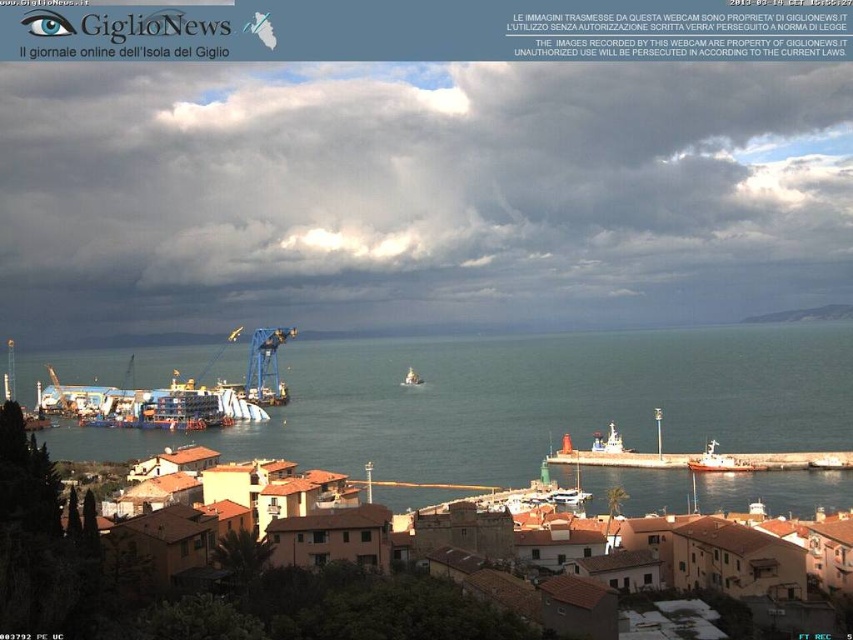
Question: Which of these objects is positioned closest to the metallic silver boat at center?

Choices:
 (A) brown matte building at lower center
 (B) metallic silver boat at lower right
 (C) blue water at center
 (D) white plastic boat at center

Answer: (C)

Question: Which point is closer to the camera?

Choices:
 (A) brown matte building at lower center
 (B) blue water at center
 (C) white plastic boat at center

Answer: (A)

Question: In this image, where is blue water at center located relative to white plastic boat at center?

Choices:
 (A) above
 (B) below

Answer: (A)

Question: Estimate the real-world distances between objects in this image. Which object is farther from the white plastic boat at center?

Choices:
 (A) metallic silver boat at lower right
 (B) metallic silver boat at center
 (C) brown matte building at lower center
 (D) blue water at center

Answer: (B)

Question: Is brown matte building at lower center positioned at the back of metallic silver boat at center?

Choices:
 (A) yes
 (B) no

Answer: (B)

Question: Is brown matte building at lower center to the right of metallic silver boat at lower right from the viewer's perspective?

Choices:
 (A) no
 (B) yes

Answer: (A)